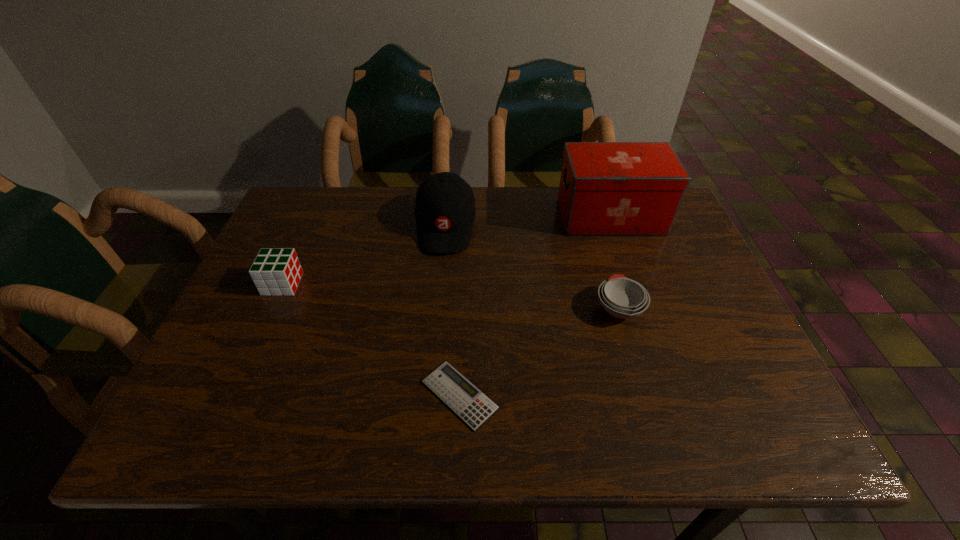
Where is `vacant position located with a logo on the front of the fourth shortest object`? vacant position located with a logo on the front of the fourth shortest object is located at coordinates (439, 296).

Where is `free space located on the red face of the leftmost object`? free space located on the red face of the leftmost object is located at coordinates (344, 284).

Identify the location of vacant region located on the back of the second shortest object. This screenshot has width=960, height=540. (605, 260).

Image resolution: width=960 pixels, height=540 pixels. What are the coordinates of `vacant space situated 0.260m on the left of the shortest object` in the screenshot? It's located at (288, 395).

This screenshot has height=540, width=960. I want to click on the first-aid kit that is at the far edge, so click(606, 188).

Find the location of a particular element. This screenshot has width=960, height=540. baseball cap positioned at the far edge is located at coordinates (445, 209).

In order to click on object present at the near edge in this screenshot , I will do `click(469, 403)`.

You are a GUI agent. You are given a task and a screenshot of the screen. Output one action in this format:
    pyautogui.click(x=<x>, y=<y>)
    Task: Click on the object that is at the left edge
    The image size is (960, 540).
    Given the screenshot: What is the action you would take?
    pyautogui.click(x=277, y=271)

The width and height of the screenshot is (960, 540). I want to click on object located in the right edge section of the desktop, so click(x=606, y=188).

Locate an element on the screen. The width and height of the screenshot is (960, 540). object present at the far right corner is located at coordinates (606, 188).